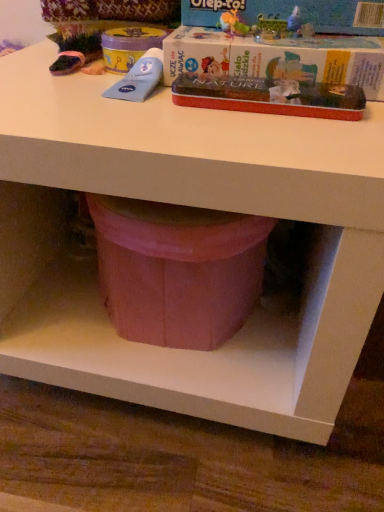
Question: Which direction should I rotate to look at matte cardboard box at upper center, which appears as the first paperback book when viewed from the top?

Choices:
 (A) left
 (B) right

Answer: (B)

Question: In which direction should I rotate to look at metallic red tin at upper center, the 1th paperback book positioned from the bottom?

Choices:
 (A) right
 (B) left

Answer: (A)

Question: Is metallic red tin at upper center, the third paperback book positioned from the top, shorter than matte cardboard box at upper center, the third paperback book from the bottom?

Choices:
 (A) no
 (B) yes

Answer: (B)

Question: Is metallic red tin at upper center, the third paperback book positioned from the top, positioned behind matte cardboard box at upper center, which appears as the first paperback book when viewed from the top?

Choices:
 (A) no
 (B) yes

Answer: (A)

Question: Considering the relative sizes of metallic red tin at upper center, the 1th paperback book positioned from the bottom, and matte cardboard box at upper center, the third paperback book from the bottom, in the image provided, is metallic red tin at upper center, the 1th paperback book positioned from the bottom, wider than matte cardboard box at upper center, the third paperback book from the bottom,?

Choices:
 (A) no
 (B) yes

Answer: (A)

Question: From the image's perspective, is metallic red tin at upper center, the 1th paperback book positioned from the bottom, beneath matte cardboard box at upper center, which appears as the first paperback book when viewed from the top?

Choices:
 (A) no
 (B) yes

Answer: (B)

Question: Is metallic red tin at upper center, the 1th paperback book positioned from the bottom, turned away from matte cardboard box at upper center, the third paperback book from the bottom?

Choices:
 (A) no
 (B) yes

Answer: (A)

Question: Can you confirm if metallic red tin at upper center, the third paperback book positioned from the top, is bigger than matte cardboard box at upper center, which appears as the first paperback book when viewed from the top?

Choices:
 (A) yes
 (B) no

Answer: (B)

Question: Is red cardboard box at upper center, which is the 2th paperback book from top to bottom, at the left side of metallic red tin at upper center, the 1th paperback book positioned from the bottom?

Choices:
 (A) no
 (B) yes

Answer: (A)

Question: Does red cardboard box at upper center, which is the 2th paperback book from top to bottom, have a greater width compared to metallic red tin at upper center, the 1th paperback book positioned from the bottom?

Choices:
 (A) no
 (B) yes

Answer: (B)

Question: Is red cardboard box at upper center, which is the 2th paperback book from top to bottom, taller than metallic red tin at upper center, the 1th paperback book positioned from the bottom?

Choices:
 (A) yes
 (B) no

Answer: (A)

Question: Is red cardboard box at upper center, which ranks as the second paperback book in bottom-to-top order, facing towards metallic red tin at upper center, the third paperback book positioned from the top?

Choices:
 (A) no
 (B) yes

Answer: (B)

Question: Is red cardboard box at upper center, which ranks as the second paperback book in bottom-to-top order, positioned before metallic red tin at upper center, the 1th paperback book positioned from the bottom?

Choices:
 (A) yes
 (B) no

Answer: (B)

Question: Can you confirm if red cardboard box at upper center, which is the 2th paperback book from top to bottom, is shorter than metallic red tin at upper center, the third paperback book positioned from the top?

Choices:
 (A) yes
 (B) no

Answer: (B)

Question: Does red cardboard box at upper center, which ranks as the second paperback book in bottom-to-top order, have a smaller size compared to matte cardboard box at upper center, which appears as the first paperback book when viewed from the top?

Choices:
 (A) yes
 (B) no

Answer: (B)